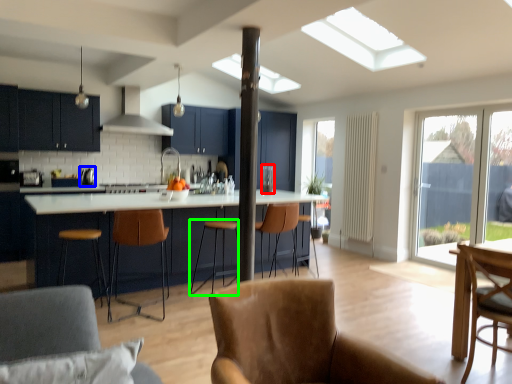
Question: Considering the real-world distances, which object is farthest from appliance (highlighted by a red box)? appliance (highlighted by a blue box) or bar stool (highlighted by a green box)?

Choices:
 (A) appliance
 (B) bar stool

Answer: (A)